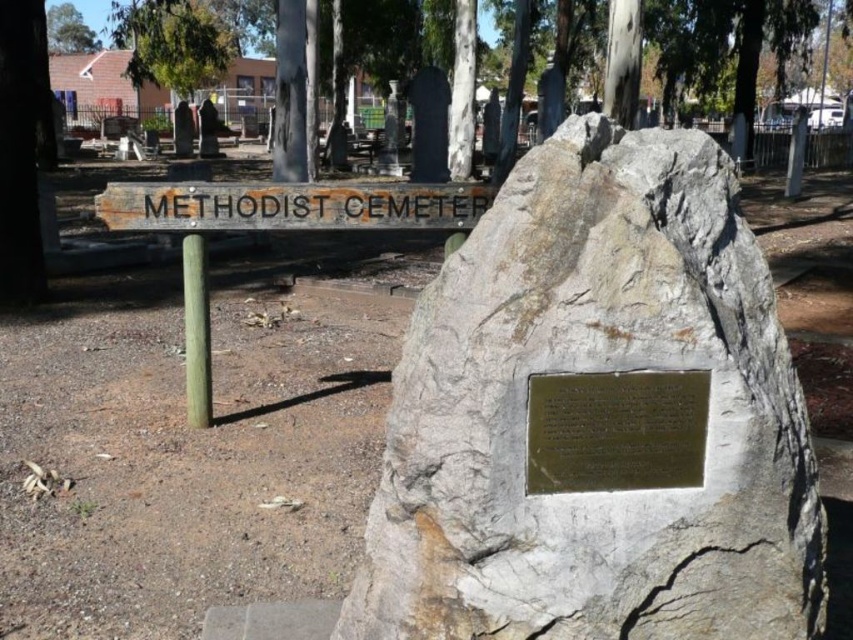
Question: Is bronze plaque at center above green leafy tree at upper left?

Choices:
 (A) no
 (B) yes

Answer: (A)

Question: Which point is farther to the camera?

Choices:
 (A) green leafy tree at upper left
 (B) bronze plaque at center

Answer: (A)

Question: Which point is farther to the camera?

Choices:
 (A) gray stone boulder at center
 (B) bronze plaque at center

Answer: (B)

Question: In this image, where is bronze plaque at center located relative to green leafy tree at upper left?

Choices:
 (A) below
 (B) above

Answer: (A)

Question: Is gray stone boulder at center below green leafy tree at upper left?

Choices:
 (A) yes
 (B) no

Answer: (A)

Question: Among these points, which one is nearest to the camera?

Choices:
 (A) click(x=496, y=321)
 (B) click(x=78, y=28)

Answer: (A)